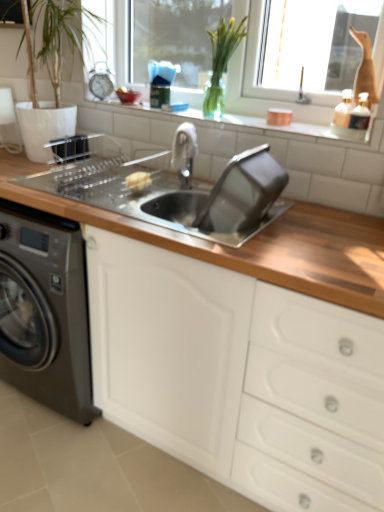
Question: Considering the positions of white glossy tile at upper center and yellow sponge at sink in the image, is white glossy tile at upper center bigger or smaller than yellow sponge at sink?

Choices:
 (A) big
 (B) small

Answer: (A)

Question: Is point (374, 136) closer or farther from the camera than point (130, 176)?

Choices:
 (A) closer
 (B) farther

Answer: (A)

Question: Based on their relative distances, which object is nearer to the wooden countertop at center?

Choices:
 (A) wooden countertop at center
 (B) polished chrome faucet at center
 (C) white plastic window frame at upper center
 (D) green glass vase at upper center
 (E) white glossy tile at upper center

Answer: (A)

Question: Estimate the real-world distances between objects in this image. Which object is closer to the white glossy tile at upper center?

Choices:
 (A) wooden countertop at center
 (B) polished chrome faucet at center
 (C) green glass vase at upper center
 (D) white plastic window frame at upper center
 (E) yellow sponge at sink

Answer: (B)